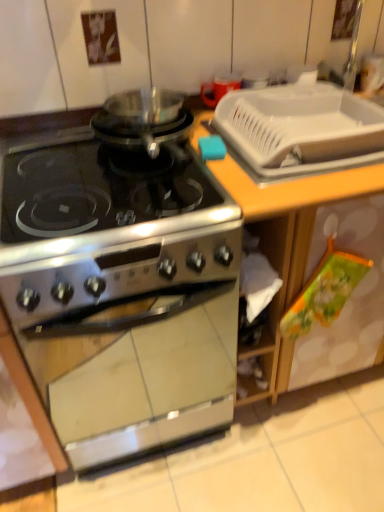
Locate an element on the screen. stainless steel stove at center is located at coordinates (121, 291).

In the scene shown: Measure the distance between point [327,342] and camera.

They are 1.30 meters apart.

Describe the element at coordinates (102, 190) in the screenshot. Image resolution: width=384 pixels, height=512 pixels. I see `satin silver gas stove at center` at that location.

Locate an element on the screen. Image resolution: width=384 pixels, height=512 pixels. white plastic tray at upper right is located at coordinates (293, 188).

Identify the location of white plastic sink at upper right. (300, 128).

Is stainless steel stove at center situated inside satin silver gas stove at center or outside?

The correct answer is: outside.

This screenshot has height=512, width=384. In the image, there is a satin silver gas stove at center. What are the coordinates of `kitchen appliance below it (from a real-world perspective)` in the screenshot? It's located at (121, 291).

Looking at this image, considering the relative sizes of stainless steel stove at center and satin silver gas stove at center in the image provided, is stainless steel stove at center thinner than satin silver gas stove at center?

No.

Is point (141, 288) more distant than point (68, 222)?

That is True.

Is wooden countertop at center not inside satin silver gas stove at center?

Absolutely, wooden countertop at center is external to satin silver gas stove at center.

Between wooden countertop at center and satin silver gas stove at center, which one is positioned in front?

satin silver gas stove at center is more forward.

Is wooden countertop at center taller or shorter than satin silver gas stove at center?

Considering their sizes, wooden countertop at center has more height than satin silver gas stove at center.

From a real-world perspective, is wooden countertop at center below satin silver gas stove at center?

Yes.

Is point (67, 322) behind point (285, 225)?

That is False.

The height and width of the screenshot is (512, 384). I want to click on counter behind the stainless steel stove at center, so click(317, 263).

Which is more to the left, stainless steel stove at center or wooden countertop at center?

stainless steel stove at center.

Are stainless steel stove at center and wooden countertop at center far apart?

Actually, stainless steel stove at center and wooden countertop at center are a little close together.

Considering the positions of objects satin silver gas stove at center and white plastic sink at upper right in the image provided, who is behind, satin silver gas stove at center or white plastic sink at upper right?

white plastic sink at upper right is behind.

Is satin silver gas stove at center facing away from white plastic sink at upper right?

No.

Is satin silver gas stove at center next to white plastic sink at upper right?

No, satin silver gas stove at center is not touching white plastic sink at upper right.

Which of these two, satin silver gas stove at center or white plastic sink at upper right, stands taller?

Standing taller between the two is white plastic sink at upper right.

Who is taller, wooden countertop at center or white plastic tray at upper right?

With more height is wooden countertop at center.

What's the angular difference between wooden countertop at center and white plastic tray at upper right's facing directions?

0.000187 degrees.

Is the position of wooden countertop at center less distant than that of white plastic tray at upper right?

Yes, wooden countertop at center is in front of white plastic tray at upper right.

Between point (324, 176) and point (198, 113), which one is positioned behind?

The point (198, 113) is behind.

Where is `counter in front of the white plastic tray at upper right`? counter in front of the white plastic tray at upper right is located at coordinates (317, 263).

Is white plastic tray at upper right aimed at wooden countertop at center?

Yes, white plastic tray at upper right is aimed at wooden countertop at center.

Considering the sizes of white plastic tray at upper right and wooden countertop at center in the image, is white plastic tray at upper right taller or shorter than wooden countertop at center?

Considering their sizes, white plastic tray at upper right has less height than wooden countertop at center.

From a real-world perspective, relative to white plastic tray at upper right, is white plastic sink at upper right vertically above or below?

Clearly, from a real-world perspective, white plastic sink at upper right is above white plastic tray at upper right.

From the image's perspective, would you say white plastic sink at upper right is shown under white plastic tray at upper right?

No.

Does white plastic sink at upper right have a greater height compared to white plastic tray at upper right?

No.

Can you confirm if white plastic sink at upper right is wider than white plastic tray at upper right?

No.

I want to click on kitchen appliance that is below the satin silver gas stove at center (from the image's perspective), so click(121, 291).

In the image, there is a wooden countertop at center. Find the location of `gas stove above it (from the image's perspective)`. gas stove above it (from the image's perspective) is located at coordinates (102, 190).

Looking at the image, which one is located further to satin silver gas stove at center, white plastic tray at upper right or wooden countertop at center?

wooden countertop at center lies further to satin silver gas stove at center than the other object.

When comparing their distances from white plastic sink at upper right, does satin silver gas stove at center or wooden countertop at center seem closer?

wooden countertop at center lies closer to white plastic sink at upper right than the other object.

From the picture: Estimate the real-world distances between objects in this image. Which object is closer to satin silver gas stove at center, stainless steel stove at center or white plastic tray at upper right?

stainless steel stove at center is positioned closer to the anchor satin silver gas stove at center.

From the image, which object appears to be nearer to satin silver gas stove at center, white plastic tray at upper right or stainless steel stove at center?

stainless steel stove at center is positioned closer to the anchor satin silver gas stove at center.

Which object lies nearer to the anchor point white plastic sink at upper right, white plastic tray at upper right or satin silver gas stove at center?

Among the two, white plastic tray at upper right is located nearer to white plastic sink at upper right.

Estimate the real-world distances between objects in this image. Which object is closer to wooden countertop at center, white plastic sink at upper right or white plastic tray at upper right?

white plastic tray at upper right lies closer to wooden countertop at center than the other object.

Based on the photo, considering their positions, is white plastic sink at upper right positioned closer to white plastic tray at upper right than satin silver gas stove at center?

Based on the image, white plastic sink at upper right appears to be nearer to white plastic tray at upper right.

Looking at the image, which one is located further to wooden countertop at center, white plastic tray at upper right or stainless steel stove at center?

stainless steel stove at center lies further to wooden countertop at center than the other object.

The width and height of the screenshot is (384, 512). What are the coordinates of `counter top between stainless steel stove at center and wooden countertop at center from left to right` in the screenshot? It's located at (293, 188).

Identify the location of counter top between satin silver gas stove at center and wooden countertop at center in the horizontal direction. This screenshot has width=384, height=512. (293, 188).

Image resolution: width=384 pixels, height=512 pixels. What are the coordinates of `sink between stainless steel stove at center and white plastic tray at upper right in the horizontal direction` in the screenshot? It's located at (300, 128).

Identify the location of sink between satin silver gas stove at center and white plastic tray at upper right from left to right. The width and height of the screenshot is (384, 512). (300, 128).